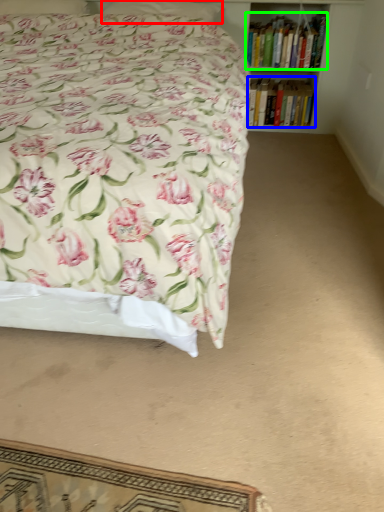
Question: Based on their relative distances, which object is farther from pillow (highlighted by a red box)? Choose from book (highlighted by a blue box) and book (highlighted by a green box).

Choices:
 (A) book
 (B) book

Answer: (A)